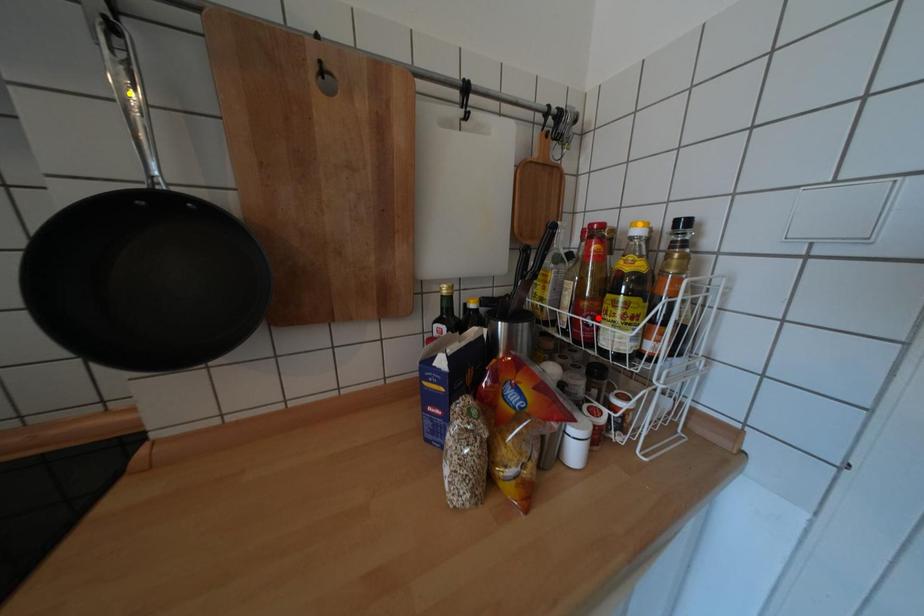
Order these from nearest to farthest:
yellow point | red point | orange point

1. yellow point
2. orange point
3. red point